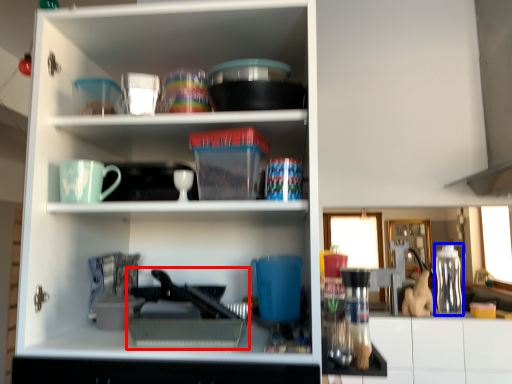
Question: Which point is closer to the camera, appliance (highlighted by a red box) or bottle (highlighted by a blue box)?

Choices:
 (A) appliance
 (B) bottle

Answer: (A)